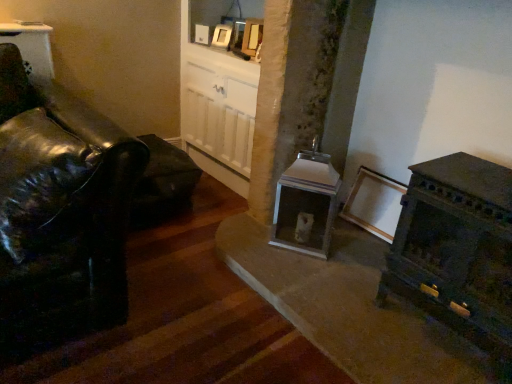
Identify the location of metallic silver fireplace at center. (306, 204).

Image resolution: width=512 pixels, height=384 pixels. Describe the element at coordinates (306, 204) in the screenshot. I see `metallic silver fireplace at center` at that location.

Measure the distance between point (306,245) and camera.

The distance of point (306,245) from camera is 6.60 feet.

Image resolution: width=512 pixels, height=384 pixels. What do you see at coordinates (222, 36) in the screenshot?
I see `white glossy picture frame at upper center` at bounding box center [222, 36].

The image size is (512, 384). What are the coordinates of `white glossy picture frame at upper center` in the screenshot? It's located at (222, 36).

What is the approximate height of white glossy picture frame at upper center?

It is 15.53 centimeters.

Image resolution: width=512 pixels, height=384 pixels. I want to click on metallic silver fireplace at center, so click(306, 204).

Would you say white glossy picture frame at upper center is to the left or to the right of metallic silver fireplace at center in the picture?

Clearly, white glossy picture frame at upper center is on the left of metallic silver fireplace at center in the image.

Which object is further away from the camera, white glossy picture frame at upper center or metallic silver fireplace at center?

Answer: white glossy picture frame at upper center is behind.

Is point (225, 25) behind point (292, 233)?

Yes, point (225, 25) is farther from viewer.

In the scene shown: From the image's perspective, which is below, white glossy picture frame at upper center or metallic silver fireplace at center?

From the image's view, metallic silver fireplace at center is below.

Looking at this image, from a real-world perspective, between white glossy picture frame at upper center and metallic silver fireplace at center, who is vertically higher?

From a 3D spatial view, white glossy picture frame at upper center is above.

Is white glossy picture frame at upper center wider or thinner than metallic silver fireplace at center?

In the image, white glossy picture frame at upper center appears to be more narrow than metallic silver fireplace at center.

Can you confirm if white glossy picture frame at upper center is shorter than metallic silver fireplace at center?

Indeed, white glossy picture frame at upper center has a lesser height compared to metallic silver fireplace at center.

Is white glossy picture frame at upper center bigger or smaller than metallic silver fireplace at center?

Clearly, white glossy picture frame at upper center is smaller in size than metallic silver fireplace at center.

Consider the image. Is white glossy picture frame at upper center spatially inside metallic silver fireplace at center, or outside of it?

white glossy picture frame at upper center is outside metallic silver fireplace at center.

Is white glossy picture frame at upper center far away from metallic silver fireplace at center?

Yes, white glossy picture frame at upper center and metallic silver fireplace at center are located far from each other.

Is white glossy picture frame at upper center turned away from metallic silver fireplace at center?

No, white glossy picture frame at upper center is not facing the opposite direction of metallic silver fireplace at center.

In order to click on fireplace that appears on the right of white glossy picture frame at upper center in this screenshot , I will do `click(306, 204)`.

Can you confirm if metallic silver fireplace at center is positioned to the right of white glossy picture frame at upper center?

Yes, metallic silver fireplace at center is to the right of white glossy picture frame at upper center.

Which is in front, metallic silver fireplace at center or white glossy picture frame at upper center?

Positioned in front is metallic silver fireplace at center.

Considering the points (298, 237) and (219, 29), which point is in front, point (298, 237) or point (219, 29)?

Positioned in front is point (298, 237).

From the image's perspective, which is below, metallic silver fireplace at center or white glossy picture frame at upper center?

metallic silver fireplace at center is shown below in the image.

From a real-world perspective, which is physically below, metallic silver fireplace at center or white glossy picture frame at upper center?

metallic silver fireplace at center, from a real-world perspective.

Between metallic silver fireplace at center and white glossy picture frame at upper center, which one has smaller width?

white glossy picture frame at upper center.

From the picture: Between metallic silver fireplace at center and white glossy picture frame at upper center, which one has less height?

white glossy picture frame at upper center.

Considering the relative sizes of metallic silver fireplace at center and white glossy picture frame at upper center in the image provided, is metallic silver fireplace at center smaller than white glossy picture frame at upper center?

Incorrect, metallic silver fireplace at center is not smaller in size than white glossy picture frame at upper center.

Is metallic silver fireplace at center spatially inside white glossy picture frame at upper center, or outside of it?

metallic silver fireplace at center is not inside white glossy picture frame at upper center, it's outside.

Would you consider metallic silver fireplace at center to be distant from white glossy picture frame at upper center?

Absolutely, metallic silver fireplace at center is distant from white glossy picture frame at upper center.

Is white glossy picture frame at upper center at the back of metallic silver fireplace at center?

metallic silver fireplace at center does not have its back to white glossy picture frame at upper center.

How distant is metallic silver fireplace at center from white glossy picture frame at upper center?

The distance of metallic silver fireplace at center from white glossy picture frame at upper center is 1.14 meters.

You are a GUI agent. You are given a task and a screenshot of the screen. Output one action in this format:
    pyautogui.click(x=<x>, y=<y>)
    Task: Click on the picture frame above the metallic silver fireplace at center (from a real-world perspective)
    Image resolution: width=512 pixels, height=384 pixels.
    Given the screenshot: What is the action you would take?
    click(222, 36)

The image size is (512, 384). In order to click on picture frame above the metallic silver fireplace at center (from a real-world perspective) in this screenshot , I will do `click(222, 36)`.

In the image, there is a white glossy picture frame at upper center. Where is `fireplace below it (from a real-world perspective)`? fireplace below it (from a real-world perspective) is located at coordinates (306, 204).